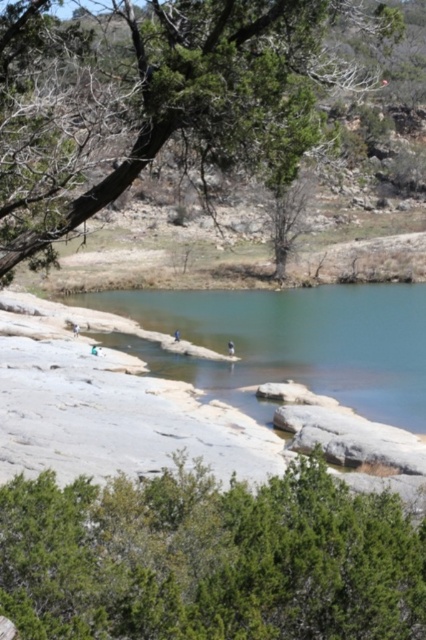
From the picture: Can you confirm if green leafy tree at upper left is smaller than clear blue water at center?

→ Yes.

Does point (331, 77) come farther from viewer compared to point (394, 308)?

No, it is in front of (394, 308).

Image resolution: width=426 pixels, height=640 pixels. In order to click on green leafy tree at upper left in this screenshot , I will do `click(201, 102)`.

Between green leafy bush at center and clear blue water at center, which one is positioned lower?

green leafy bush at center is below.

Does green leafy bush at center have a greater width compared to clear blue water at center?

In fact, green leafy bush at center might be narrower than clear blue water at center.

Is point (34, 481) positioned behind point (333, 301)?

No, (34, 481) is closer to viewer.

Where is `green leafy bush at center`? This screenshot has height=640, width=426. green leafy bush at center is located at coordinates (210, 557).

Consider the image. Can you confirm if green leafy bush at center is positioned to the left of green leafy tree at upper left?

Yes, green leafy bush at center is to the left of green leafy tree at upper left.

Measure the distance from green leafy bush at center to green leafy tree at upper left.

green leafy bush at center and green leafy tree at upper left are 6.38 meters apart.

Describe the element at coordinates (210, 557) in the screenshot. I see `green leafy bush at center` at that location.

The height and width of the screenshot is (640, 426). I want to click on green leafy bush at center, so click(210, 557).